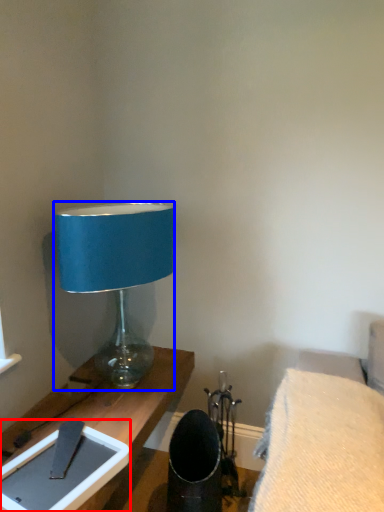
Question: Which point is further to the camera, tablet computer (highlighted by a red box) or lamp (highlighted by a blue box)?

Choices:
 (A) tablet computer
 (B) lamp

Answer: (B)